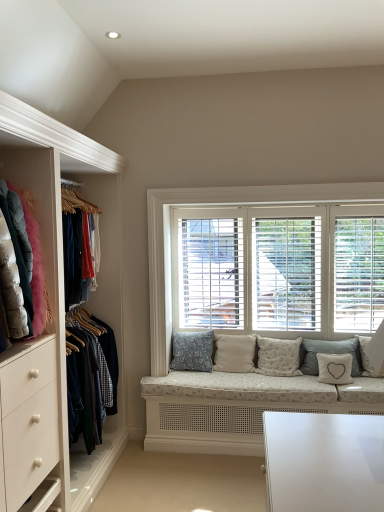
Question: Considering the relative sizes of fluffy white pillow at center, the fourth pillow from the right, and beige fabric cushion at center, acting as the 2th pillow starting from the left, in the image provided, is fluffy white pillow at center, the fourth pillow from the right, wider than beige fabric cushion at center, acting as the 2th pillow starting from the left,?

Choices:
 (A) yes
 (B) no

Answer: (A)

Question: Is the position of fluffy white pillow at center, the fourth pillow from the right, less distant than that of beige fabric cushion at center, acting as the 2th pillow starting from the left?

Choices:
 (A) yes
 (B) no

Answer: (A)

Question: From the image's perspective, does fluffy white pillow at center, which is counted as the 3th pillow, starting from the left, appear lower than beige fabric cushion at center, which is the fifth pillow from right to left?

Choices:
 (A) yes
 (B) no

Answer: (A)

Question: Is fluffy white pillow at center, the fourth pillow from the right, outside beige fabric cushion at center, acting as the 2th pillow starting from the left?

Choices:
 (A) yes
 (B) no

Answer: (A)

Question: Considering the relative sizes of fluffy white pillow at center, which is counted as the 3th pillow, starting from the left, and beige fabric cushion at center, acting as the 2th pillow starting from the left, in the image provided, is fluffy white pillow at center, which is counted as the 3th pillow, starting from the left, taller than beige fabric cushion at center, acting as the 2th pillow starting from the left,?

Choices:
 (A) no
 (B) yes

Answer: (B)

Question: Is velvet jackets at left to the left or to the right of blue textured cushion at center, the first pillow when ordered from left to right, in the image?

Choices:
 (A) right
 (B) left

Answer: (B)

Question: Is velvet jackets at left taller or shorter than blue textured cushion at center, marked as the sixth pillow in a right-to-left arrangement?

Choices:
 (A) tall
 (B) short

Answer: (A)

Question: From a real-world perspective, is velvet jackets at left physically located above or below blue textured cushion at center, marked as the sixth pillow in a right-to-left arrangement?

Choices:
 (A) below
 (B) above

Answer: (B)

Question: Is velvet jackets at left in front of or behind blue textured cushion at center, the first pillow when ordered from left to right, in the image?

Choices:
 (A) front
 (B) behind

Answer: (A)

Question: Is blue textured cushion at center, marked as the sixth pillow in a right-to-left arrangement, inside or outside of beige fabric cushion at center, which is the fifth pillow from right to left?

Choices:
 (A) inside
 (B) outside

Answer: (B)

Question: Considering their positions, is blue textured cushion at center, the first pillow when ordered from left to right, located in front of or behind beige fabric cushion at center, acting as the 2th pillow starting from the left?

Choices:
 (A) behind
 (B) front

Answer: (B)

Question: Considering the positions of blue textured cushion at center, the first pillow when ordered from left to right, and beige fabric cushion at center, acting as the 2th pillow starting from the left, in the image, is blue textured cushion at center, the first pillow when ordered from left to right, wider or thinner than beige fabric cushion at center, acting as the 2th pillow starting from the left,?

Choices:
 (A) thin
 (B) wide

Answer: (B)

Question: Considering the positions of blue textured cushion at center, the first pillow when ordered from left to right, and beige fabric cushion at center, acting as the 2th pillow starting from the left, in the image, is blue textured cushion at center, the first pillow when ordered from left to right, bigger or smaller than beige fabric cushion at center, acting as the 2th pillow starting from the left,?

Choices:
 (A) big
 (B) small

Answer: (A)

Question: Is light gray fabric pillow at center, which is counted as the second pillow, starting from the right, inside or outside of white wood blinds at center?

Choices:
 (A) inside
 (B) outside

Answer: (B)

Question: Considering the positions of point (304, 361) and point (276, 192), is point (304, 361) closer or farther from the camera than point (276, 192)?

Choices:
 (A) farther
 (B) closer

Answer: (A)